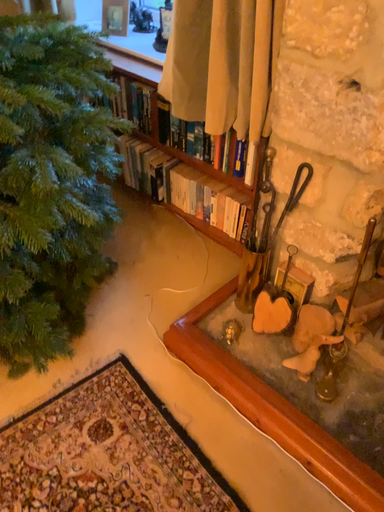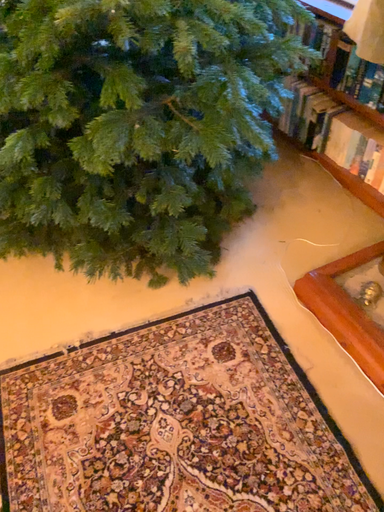
Question: Which way did the camera rotate in the video?

Choices:
 (A) rotated left
 (B) rotated right

Answer: (A)